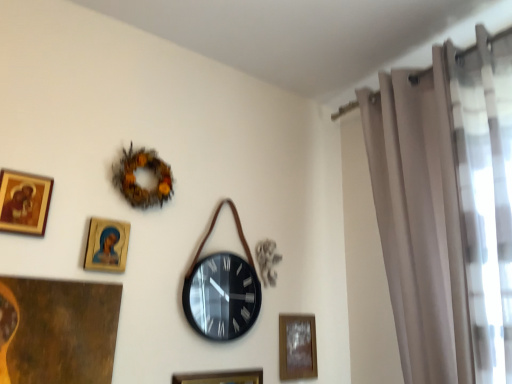
Question: Is gold-framed picture at upper left, the first picture frame positioned from the left, placed right next to black matte wall clock at center?

Choices:
 (A) no
 (B) yes

Answer: (A)

Question: Considering the relative sizes of gold-framed picture at upper left, the first picture frame positioned from the left, and black matte wall clock at center in the image provided, is gold-framed picture at upper left, the first picture frame positioned from the left, taller than black matte wall clock at center?

Choices:
 (A) no
 (B) yes

Answer: (A)

Question: Considering the relative sizes of gold-framed picture at upper left, placed as the 1th picture frame when sorted from front to back, and black matte wall clock at center in the image provided, is gold-framed picture at upper left, placed as the 1th picture frame when sorted from front to back, smaller than black matte wall clock at center?

Choices:
 (A) yes
 (B) no

Answer: (A)

Question: Is gold-framed picture at upper left, the fourth picture frame in the right-to-left sequence, located outside black matte wall clock at center?

Choices:
 (A) yes
 (B) no

Answer: (A)

Question: From the image's perspective, is gold-framed picture at upper left, which is counted as the first picture frame, starting from the top, under black matte wall clock at center?

Choices:
 (A) yes
 (B) no

Answer: (B)

Question: Is gold-framed picture at upper left, the fourth picture frame in the right-to-left sequence, turned away from black matte wall clock at center?

Choices:
 (A) no
 (B) yes

Answer: (A)

Question: Is wooden glossy picture frame at upper left, the third picture frame from the right, located within black matte wall clock at center?

Choices:
 (A) yes
 (B) no

Answer: (B)

Question: Can we say black matte wall clock at center lies outside wooden glossy picture frame at upper left, which appears as the third picture frame when ordered from the bottom?

Choices:
 (A) yes
 (B) no

Answer: (A)

Question: Is black matte wall clock at center bigger than wooden glossy picture frame at upper left, which is the 2th picture frame from left to right?

Choices:
 (A) no
 (B) yes

Answer: (B)

Question: Does black matte wall clock at center have a lesser height compared to wooden glossy picture frame at upper left, which is counted as the 2th picture frame, starting from the front?

Choices:
 (A) yes
 (B) no

Answer: (B)

Question: Can you confirm if black matte wall clock at center is thinner than wooden glossy picture frame at upper left, which is the 2th picture frame from left to right?

Choices:
 (A) no
 (B) yes

Answer: (A)

Question: Is black matte wall clock at center with wooden glossy picture frame at upper left, which is the 2th picture frame in top-to-bottom order?

Choices:
 (A) no
 (B) yes

Answer: (A)

Question: Is beige sheer curtain at right to the left of wooden glossy picture frame at upper left, the 3th picture frame positioned from the back, from the viewer's perspective?

Choices:
 (A) no
 (B) yes

Answer: (A)